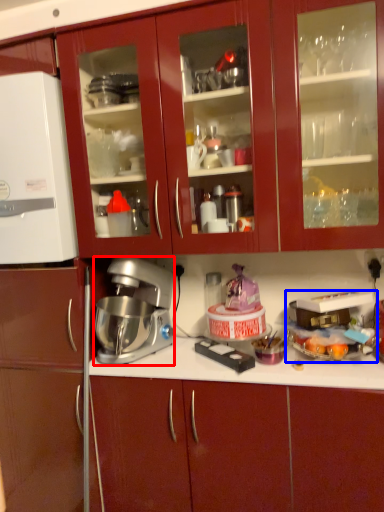
Question: Which object appears closest to the camera in this image, mixer (highlighted by a red box) or appliance (highlighted by a blue box)?

Choices:
 (A) mixer
 (B) appliance

Answer: (B)